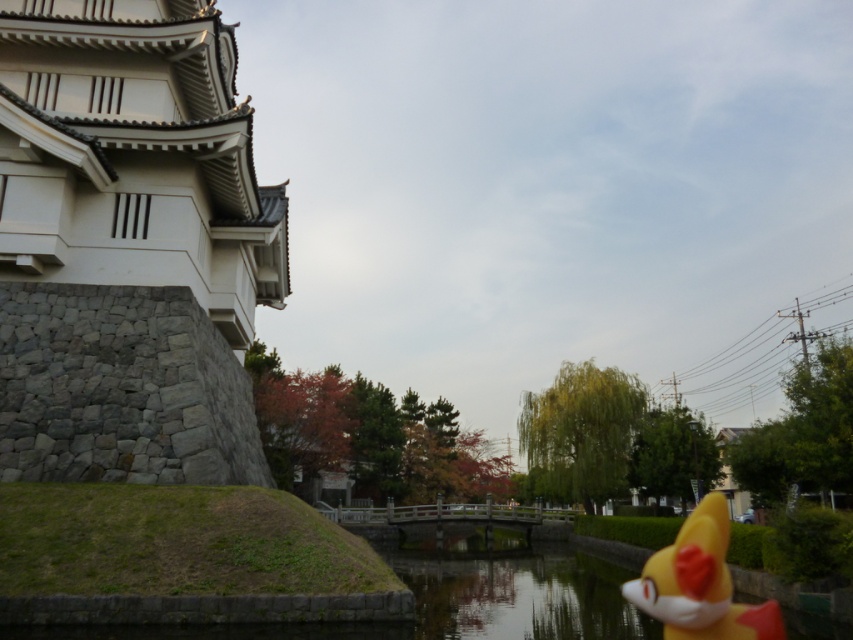
Question: Can you confirm if white stone tower at left is positioned to the left of yellow rubber fox at lower right?

Choices:
 (A) yes
 (B) no

Answer: (A)

Question: Does white stone tower at left have a greater width compared to yellow rubber fox at lower right?

Choices:
 (A) yes
 (B) no

Answer: (B)

Question: Which object appears closest to the camera in this image?

Choices:
 (A) white stone tower at left
 (B) yellow rubber fox at lower right

Answer: (B)

Question: Is white stone tower at left smaller than yellow rubber fox at lower right?

Choices:
 (A) yes
 (B) no

Answer: (A)

Question: Which object is farther from the camera taking this photo?

Choices:
 (A) yellow rubber fox at lower right
 (B) white stone tower at left

Answer: (B)